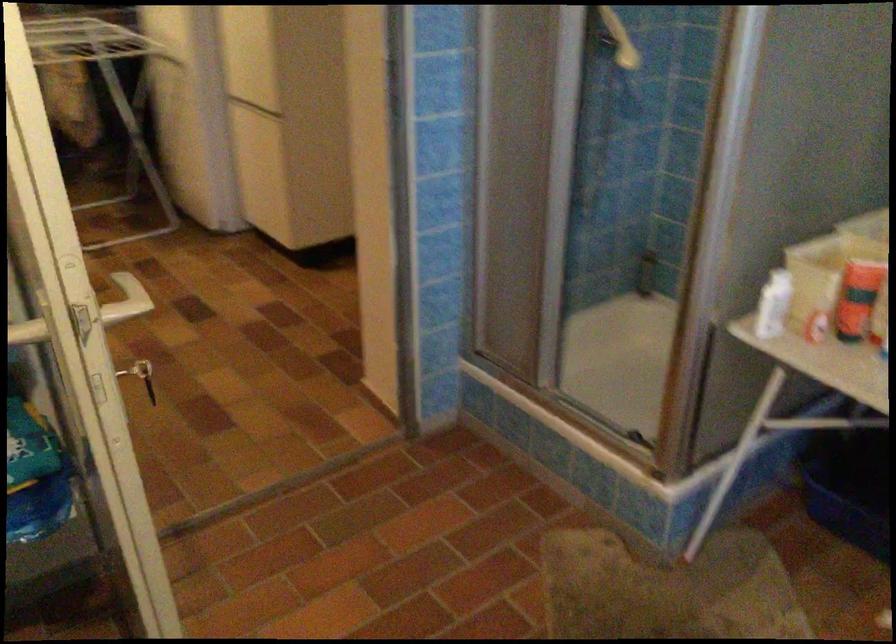
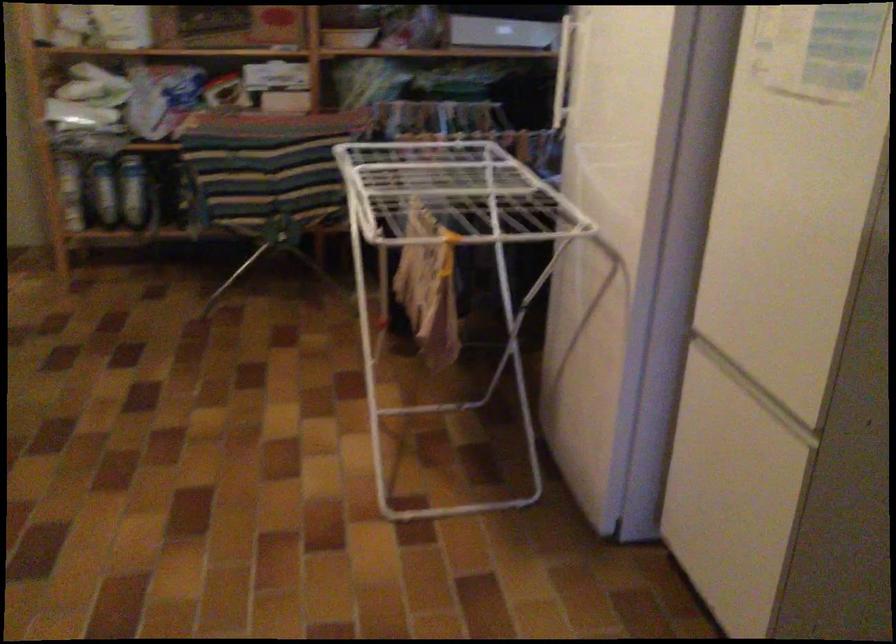
What movement of the cameraman would produce the second image?

The cameraman walked toward left, forward.